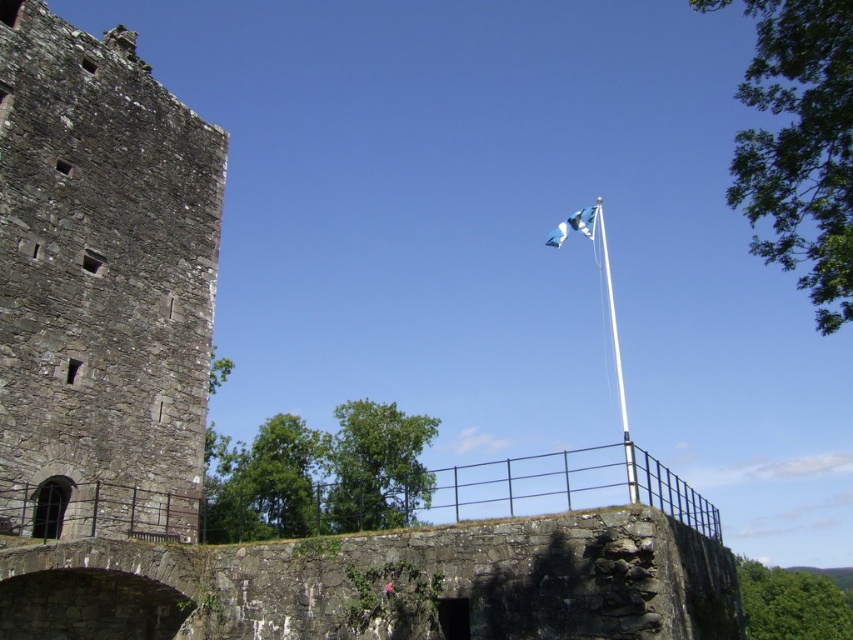
Does white metallic flag pole at upper right appear under blue fabric flag at upper center?

Yes.

The image size is (853, 640). What do you see at coordinates (616, 358) in the screenshot?
I see `white metallic flag pole at upper right` at bounding box center [616, 358].

The width and height of the screenshot is (853, 640). Identify the location of white metallic flag pole at upper right. (616, 358).

Does rough stone tower at left have a greater width compared to white metallic flag pole at upper right?

No, rough stone tower at left is not wider than white metallic flag pole at upper right.

Does rough stone tower at left appear under white metallic flag pole at upper right?

No.

Who is more forward, [164,525] or [625,464]?

Point [164,525] is in front.

Find the location of `rough stone tower at left`. rough stone tower at left is located at coordinates (102, 284).

What do you see at coordinates (102, 284) in the screenshot? I see `rough stone tower at left` at bounding box center [102, 284].

Describe the element at coordinates (102, 284) in the screenshot. The width and height of the screenshot is (853, 640). I see `rough stone tower at left` at that location.

Where is `rough stone tower at left`? The width and height of the screenshot is (853, 640). rough stone tower at left is located at coordinates (102, 284).